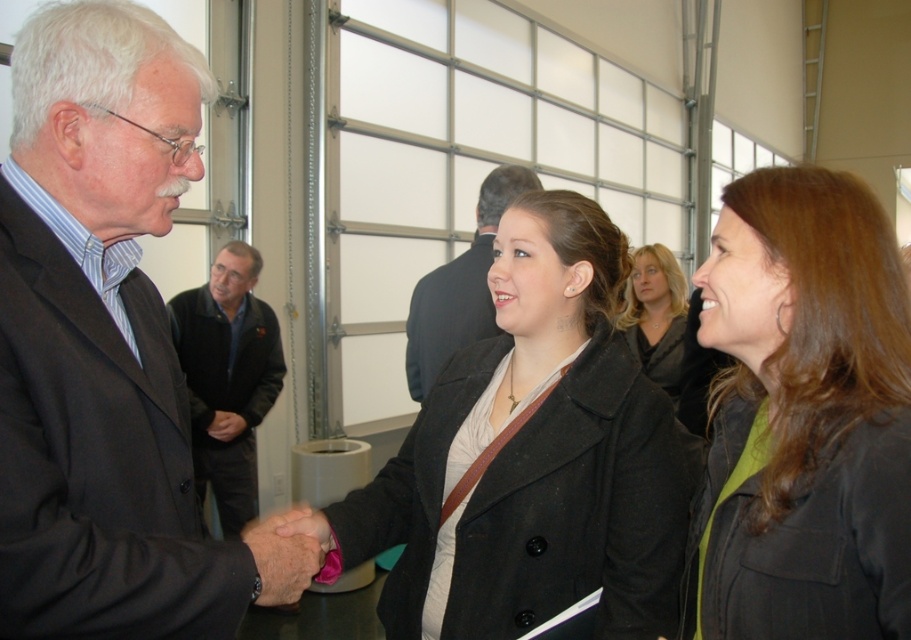
Question: Can you confirm if dark gray wool suit at left is positioned to the left of dark gray suit at center?

Choices:
 (A) no
 (B) yes

Answer: (B)

Question: Estimate the real-world distances between objects in this image. Which object is closer to the dark gray wool suit at left?

Choices:
 (A) blonde hair at center
 (B) matte black jacket at center
 (C) smooth leather hand at center
 (D) dark gray suit at center

Answer: (C)

Question: Which point is closer to the camera taking this photo?

Choices:
 (A) (444, 316)
 (B) (667, 285)

Answer: (A)

Question: Can you confirm if matte black coat at center is smaller than dark gray wool suit at left?

Choices:
 (A) no
 (B) yes

Answer: (A)

Question: Is blonde hair at center closer to the viewer compared to smooth leather hand at center?

Choices:
 (A) no
 (B) yes

Answer: (A)

Question: Which object is farther from the camera taking this photo?

Choices:
 (A) matte black coat at center
 (B) dark gray wool suit at left

Answer: (A)